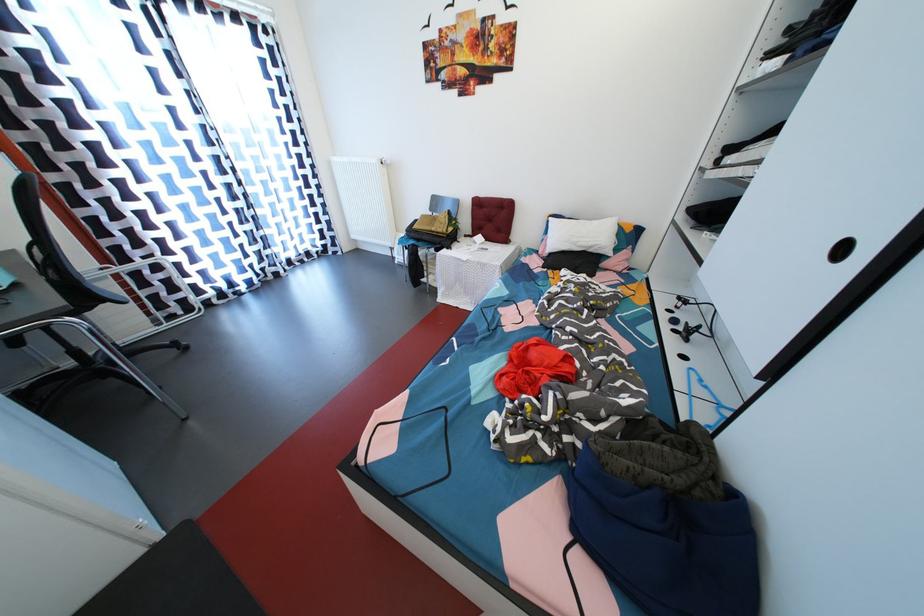
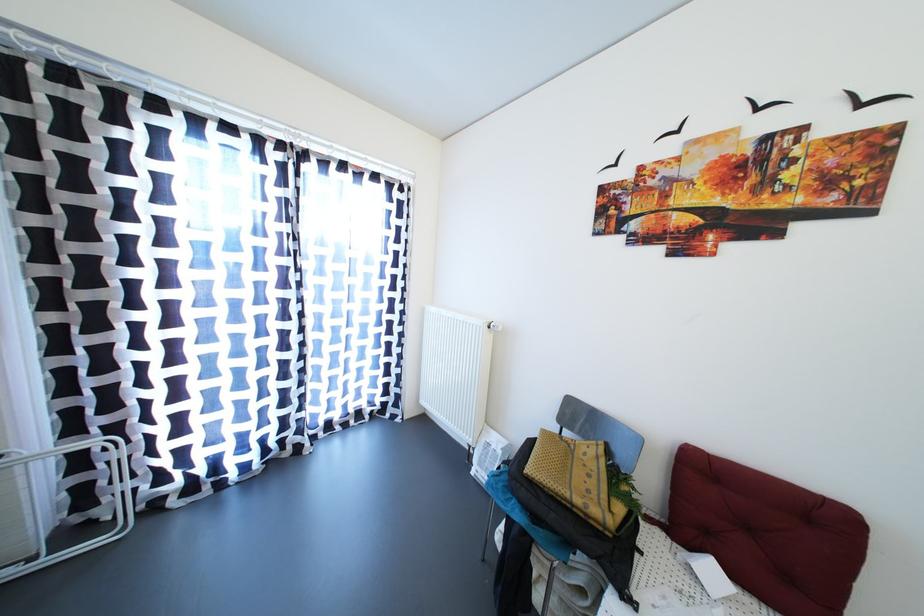
Where in the second image is the point corresponding to the point at 440,233 from the first image?

(584, 506)